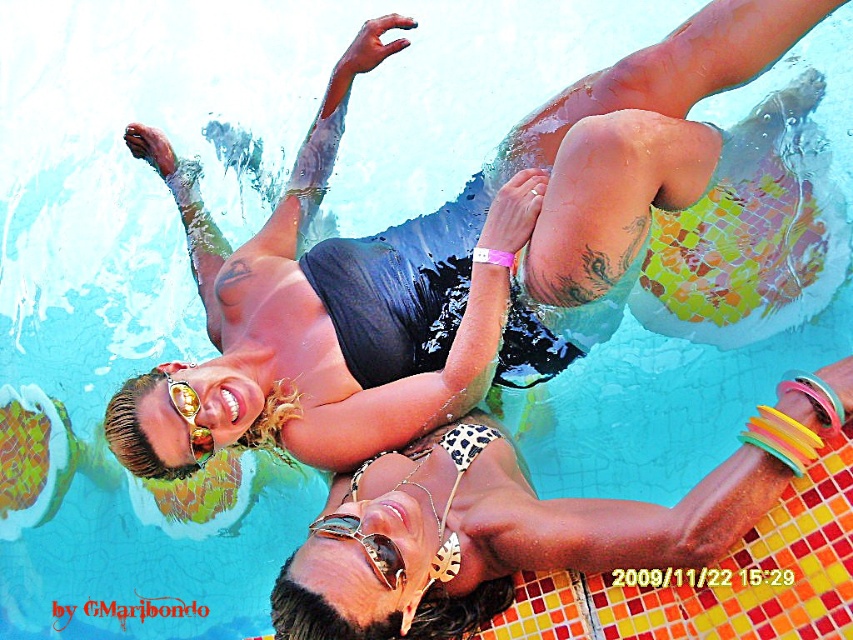
Which is above, leopard print bikini top at upper center or gold reflective sunglasses at upper center?

Result: gold reflective sunglasses at upper center is above.

Can you confirm if leopard print bikini top at upper center is positioned below gold reflective sunglasses at upper center?

Correct, leopard print bikini top at upper center is located below gold reflective sunglasses at upper center.

The width and height of the screenshot is (853, 640). Identify the location of leopard print bikini top at upper center. (521, 522).

Find the location of a particular element. The image size is (853, 640). leopard print bikini top at upper center is located at coordinates (521, 522).

Does leopard print bikini top at upper center appear on the left side of gold metallic goggles at center?

No, leopard print bikini top at upper center is not to the left of gold metallic goggles at center.

Does leopard print bikini top at upper center have a smaller size compared to gold metallic goggles at center?

Actually, leopard print bikini top at upper center might be larger than gold metallic goggles at center.

The height and width of the screenshot is (640, 853). What do you see at coordinates (521, 522) in the screenshot?
I see `leopard print bikini top at upper center` at bounding box center [521, 522].

This screenshot has height=640, width=853. Identify the location of leopard print bikini top at upper center. (521, 522).

Based on the photo, does gold metallic goggles at center have a greater width compared to gold reflective sunglasses at upper center?

Correct, the width of gold metallic goggles at center exceeds that of gold reflective sunglasses at upper center.

Based on the photo, is the position of gold metallic goggles at center more distant than that of gold reflective sunglasses at upper center?

That is False.

This screenshot has width=853, height=640. What do you see at coordinates (364, 545) in the screenshot?
I see `gold metallic goggles at center` at bounding box center [364, 545].

Image resolution: width=853 pixels, height=640 pixels. Identify the location of gold metallic goggles at center. (364, 545).